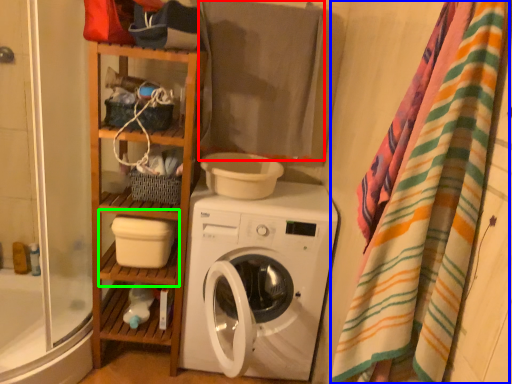
Question: Which is farther away from beach towel (highlighted by a red box)? blanket (highlighted by a blue box) or shelf (highlighted by a green box)?

Choices:
 (A) blanket
 (B) shelf

Answer: (A)